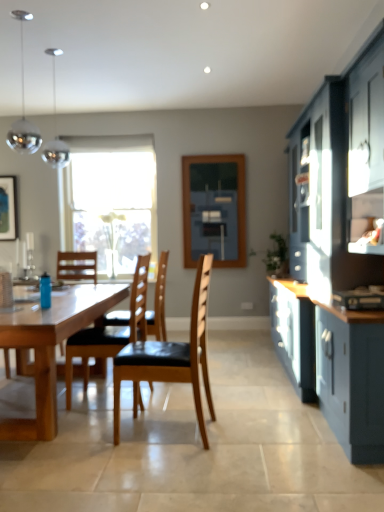
Where is `free space to the back side of blue matte water bottle at table left`? The width and height of the screenshot is (384, 512). free space to the back side of blue matte water bottle at table left is located at coordinates (62, 303).